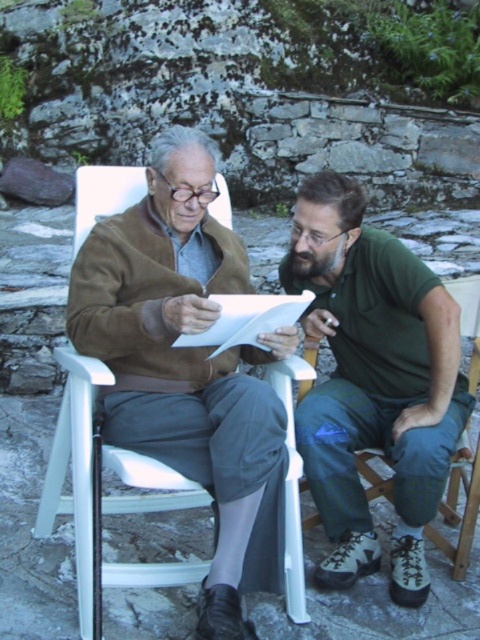
Is green fabric shirt at right positioned at the back of white plastic chair at center?

Yes, it is behind white plastic chair at center.

Between green fabric shirt at right and white plastic chair at center, which one appears on the left side from the viewer's perspective?

white plastic chair at center is more to the left.

Locate an element on the screen. green fabric shirt at right is located at coordinates (373, 381).